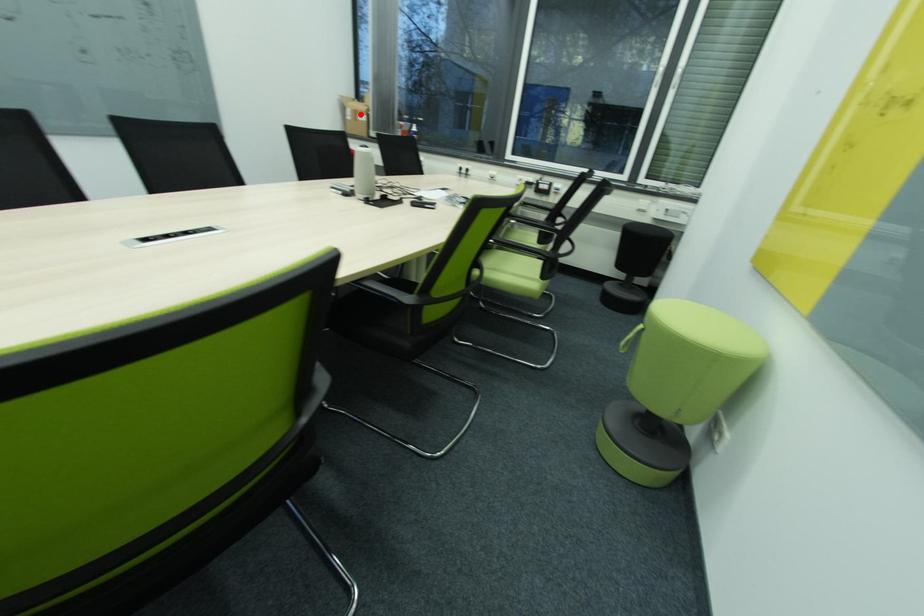
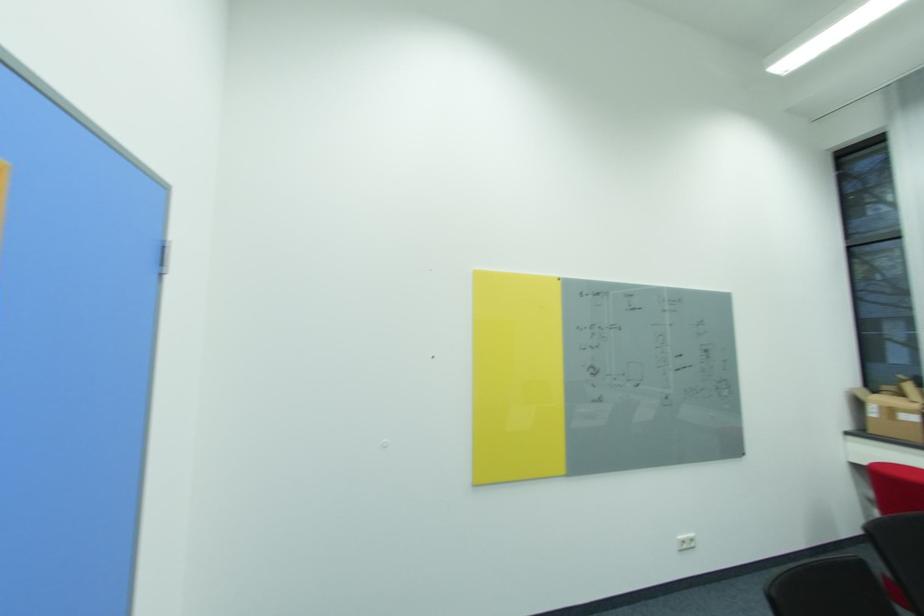
Find the pixel in the second image that matches the highlighted location in the first image.

(895, 411)